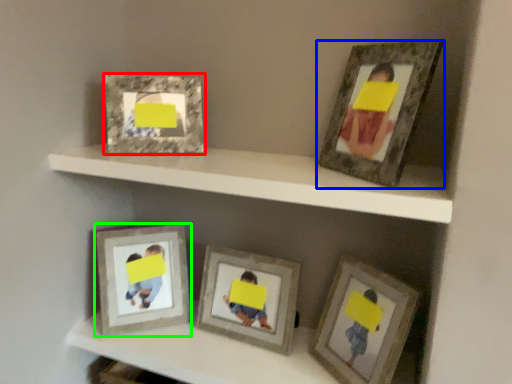
Question: Which object is positioned closest to picture frame (highlighted by a red box)? Select from picture frame (highlighted by a blue box) and picture frame (highlighted by a green box).

Choices:
 (A) picture frame
 (B) picture frame

Answer: (B)